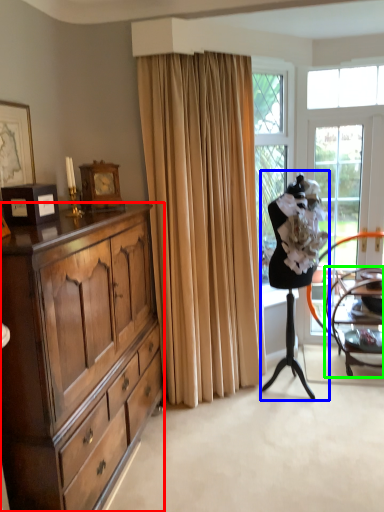
Question: Considering the real-world distances, which object is closest to cabinetry (highlighted by a red box)? ballet dancer (highlighted by a blue box) or chair (highlighted by a green box).

Choices:
 (A) ballet dancer
 (B) chair

Answer: (A)